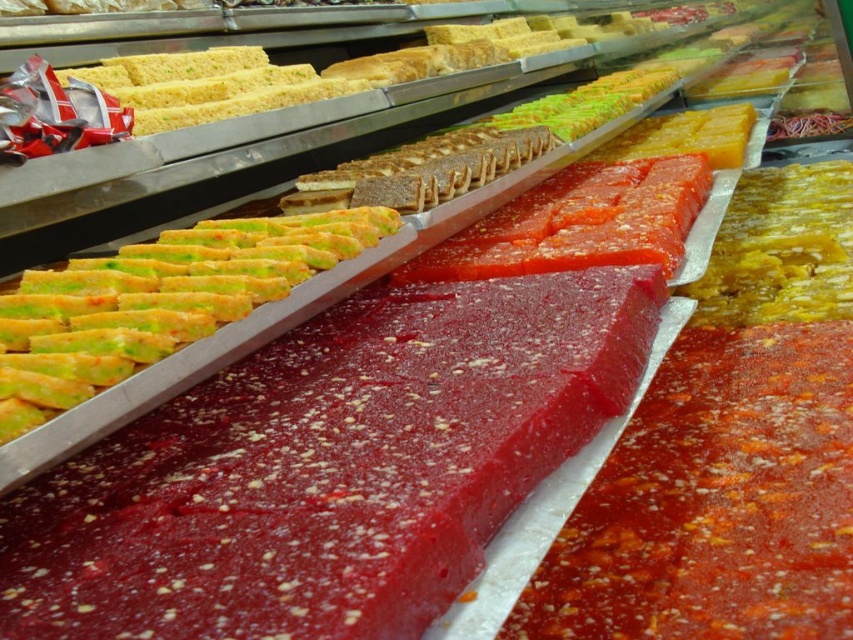
Which is more to the left, red speckled gelatinous at center or yellow matte rectangular block at upper right?

Positioned to the left is red speckled gelatinous at center.

Does red speckled gelatinous at center have a lesser height compared to yellow matte rectangular block at upper right?

Yes.

Measure the distance between red speckled gelatinous at center and camera.

The distance of red speckled gelatinous at center from camera is 90.37 centimeters.

This screenshot has height=640, width=853. I want to click on red speckled gelatinous at center, so click(715, 500).

Does brown crumbly bars at center come in front of yellow matte rectangular block at upper right?

Yes, brown crumbly bars at center is in front of yellow matte rectangular block at upper right.

Who is taller, brown crumbly bars at center or yellow matte rectangular block at upper right?

yellow matte rectangular block at upper right is taller.

Is point (524, 145) positioned in front of point (730, 154)?

Yes, it is.

You are a GUI agent. You are given a task and a screenshot of the screen. Output one action in this format:
    pyautogui.click(x=<x>, y=<y>)
    Task: Click on the brown crumbly bars at center
    
    Given the screenshot: What is the action you would take?
    pyautogui.click(x=421, y=170)

Which is in front, point (32, 388) or point (508, 138)?

Point (32, 388) is in front.

Looking at this image, does green textured pastry at upper left have a smaller size compared to brown crumbly bars at center?

Indeed, green textured pastry at upper left has a smaller size compared to brown crumbly bars at center.

I want to click on green textured pastry at upper left, so click(x=155, y=301).

This screenshot has height=640, width=853. Identify the location of green textured pastry at upper left. (155, 301).